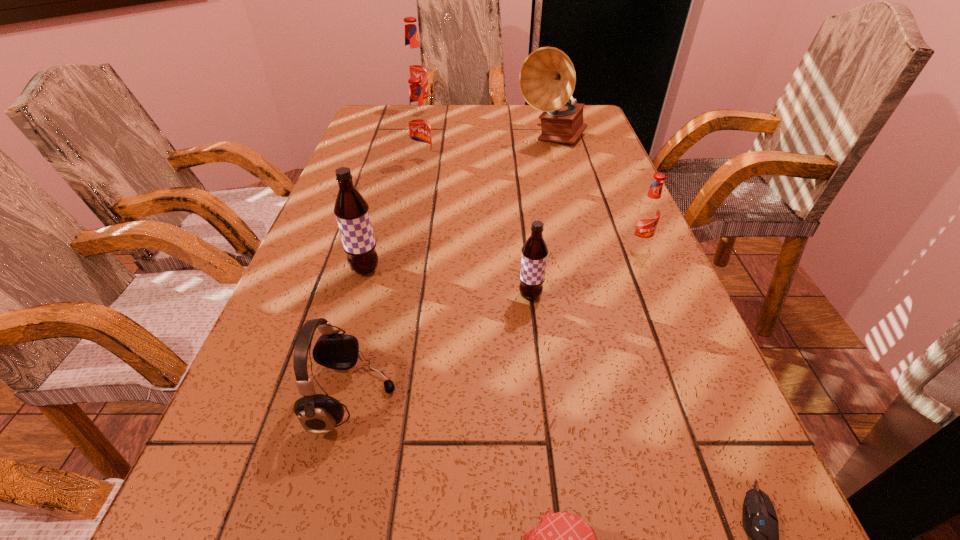
Find the location of a particular element. The width and height of the screenshot is (960, 540). phonograph record that is at the far edge is located at coordinates (547, 78).

The image size is (960, 540). Find the location of `headset present at the left edge`. headset present at the left edge is located at coordinates (x=318, y=414).

I want to click on phonograph record present at the right edge, so click(x=547, y=78).

At what (x,y) coordinates should I click in order to perform the action: click on root beer at the right edge. Please return your answer as a coordinate pair (x, y). This screenshot has height=540, width=960. Looking at the image, I should click on (648, 213).

Locate an element on the screen. object that is at the far left corner is located at coordinates (414, 65).

Image resolution: width=960 pixels, height=540 pixels. In order to click on object that is positioned at the far right corner in this screenshot , I will do `click(547, 78)`.

In the image, there is a desktop. What are the coordinates of `vacant space at the far edge` in the screenshot? It's located at (535, 111).

Find the location of `free space at the left edge of the desktop`. free space at the left edge of the desktop is located at coordinates (249, 412).

This screenshot has width=960, height=540. What are the coordinates of `free location at the right edge` in the screenshot? It's located at (681, 417).

At what (x,y) coordinates should I click in order to perform the action: click on free location at the far left corner of the desktop. Please return your answer as a coordinate pair (x, y). Looking at the image, I should click on pyautogui.click(x=390, y=111).